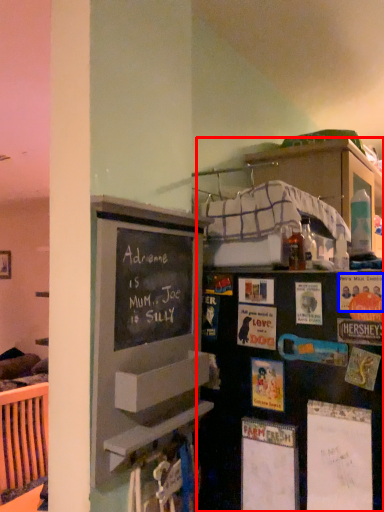
Question: Which point is further to the camera, bookshelf (highlighted by a red box) or postcard (highlighted by a blue box)?

Choices:
 (A) bookshelf
 (B) postcard

Answer: (B)